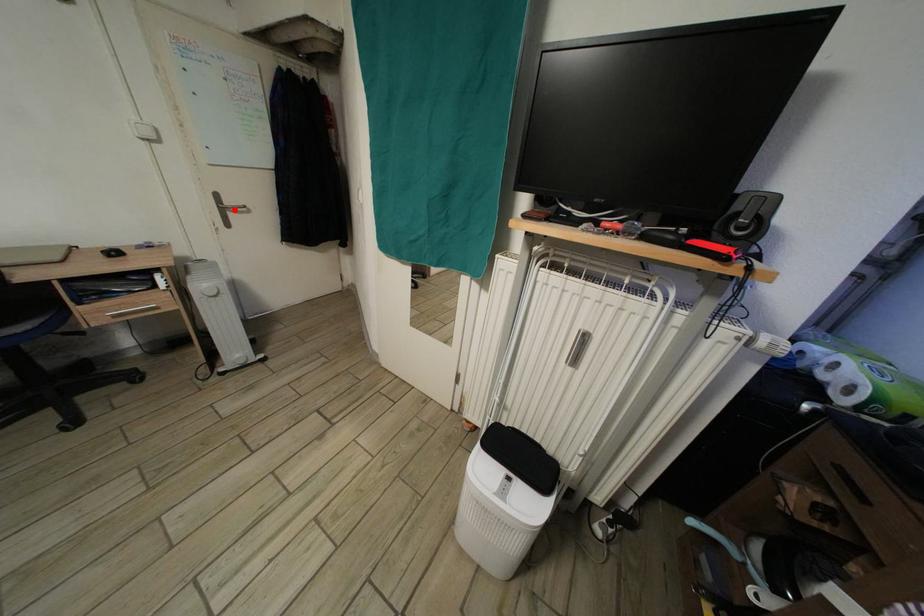
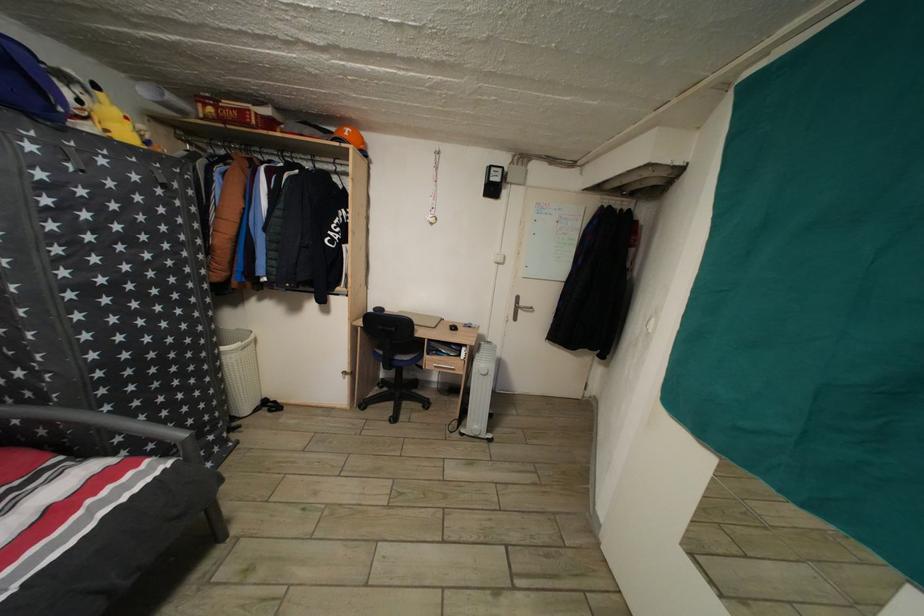
In the second image, find the point that corresponds to the highlighted location in the first image.

(529, 310)